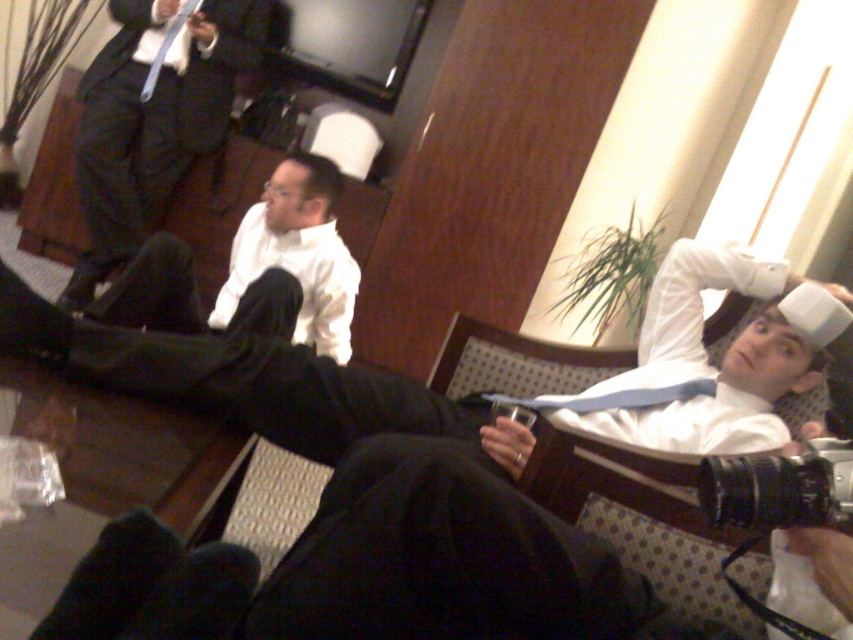
Question: Which object is closer to the camera taking this photo?

Choices:
 (A) matte white cup at upper right
 (B) white matte shirt at center
 (C) matte black suit at upper left
 (D) matte blue tie at upper left

Answer: (A)

Question: Estimate the real-world distances between objects in this image. Which object is farther from the matte white cup at upper right?

Choices:
 (A) white matte shirt at center
 (B) matte black suit at upper left

Answer: (B)

Question: Which point appears closest to the camera in this image?

Choices:
 (A) (318, 385)
 (B) (178, 32)
 (C) (148, 92)

Answer: (A)

Question: Can you confirm if matte white cup at upper right is wider than matte black suit at upper left?

Choices:
 (A) yes
 (B) no

Answer: (A)

Question: From the image, what is the correct spatial relationship of matte white cup at upper right in relation to matte blue tie at upper left?

Choices:
 (A) left
 (B) right

Answer: (B)

Question: Does matte black suit at upper left have a lesser width compared to matte blue tie at upper left?

Choices:
 (A) yes
 (B) no

Answer: (B)